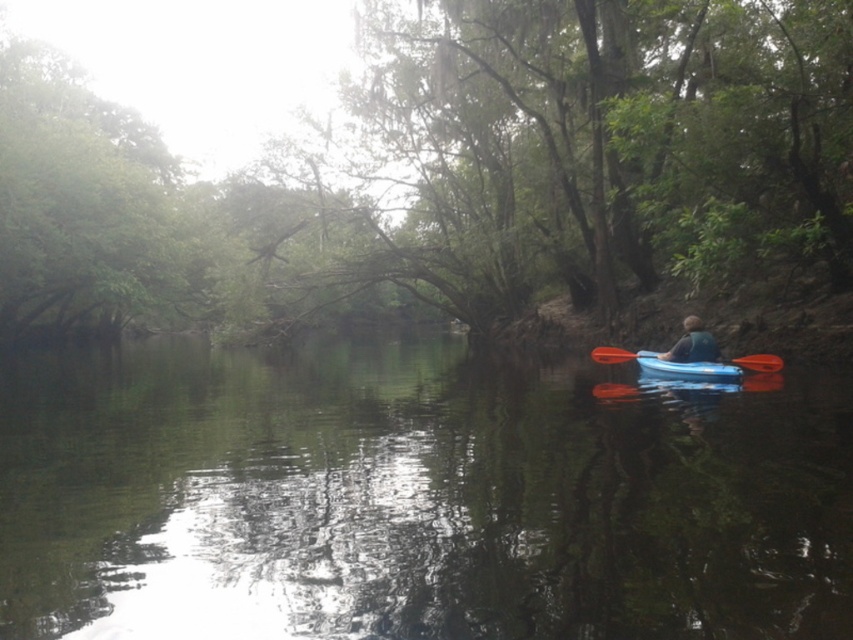
Between blue plastic kayak at right and blue plastic kayak at center, which one is positioned lower?

blue plastic kayak at right

Image resolution: width=853 pixels, height=640 pixels. What are the coordinates of `blue plastic kayak at right` in the screenshot? It's located at (413, 497).

You are a GUI agent. You are given a task and a screenshot of the screen. Output one action in this format:
    pyautogui.click(x=<x>, y=<y>)
    Task: Click on the blue plastic kayak at right
    Image resolution: width=853 pixels, height=640 pixels.
    Given the screenshot: What is the action you would take?
    pyautogui.click(x=413, y=497)

Consider the image. Is blue plastic kayak at right thinner than orange plastic paddle at center?

In fact, blue plastic kayak at right might be wider than orange plastic paddle at center.

Does blue plastic kayak at right have a greater width compared to orange plastic paddle at center?

Yes.

Describe the element at coordinates (413, 497) in the screenshot. I see `blue plastic kayak at right` at that location.

The height and width of the screenshot is (640, 853). Find the location of `blue plastic kayak at right`. blue plastic kayak at right is located at coordinates (413, 497).

Who is shorter, translucent blue kayak at center or orange plastic paddle at center?

orange plastic paddle at center is shorter.

Which is behind, point (688, 364) or point (775, 356)?

The point (775, 356) is more distant.

Where is `translucent blue kayak at center`? translucent blue kayak at center is located at coordinates (688, 369).